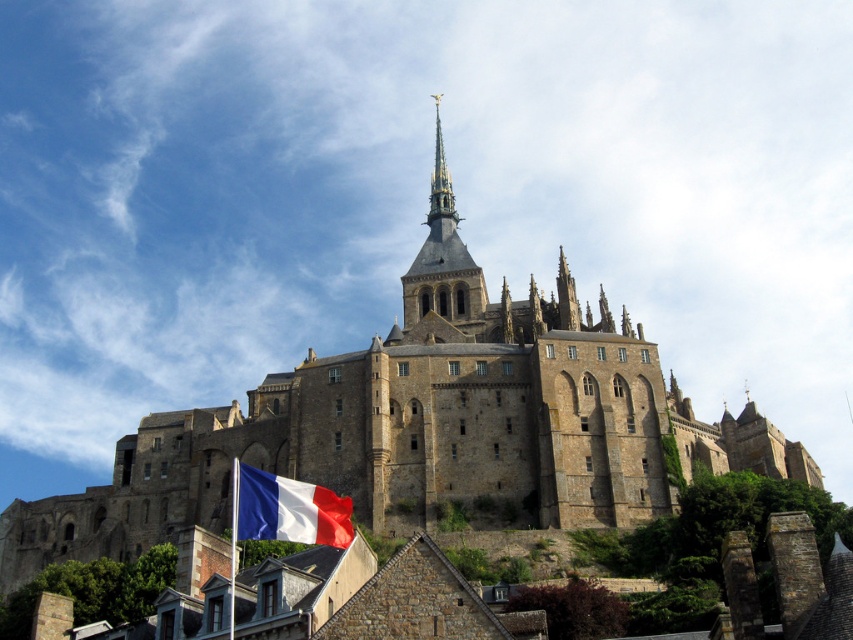
You are a tourist standing at the base of Mont Saint Michel and want to take a photo that includes both the golden stone spire at upper center and the polyester french flag at lower left. Which object should you position closer to the left side of your camera frame to ensure both are in the shot?

You should position the polyester french flag at lower left closer to the left side of your camera frame because the golden stone spire at upper center is already on the right side of the polyester french flag at lower left, so placing the flag on the left keeps both in frame.

You are standing at the base of Mont Saint Michel and want to take a photo of the island. You notice two points marked on your map at coordinates point (x=434, y=257) and point (x=250, y=508). Which point is closer to you when facing the island?

Point (x=250, y=508) is closer to you because it is in front of point (x=434, y=257).